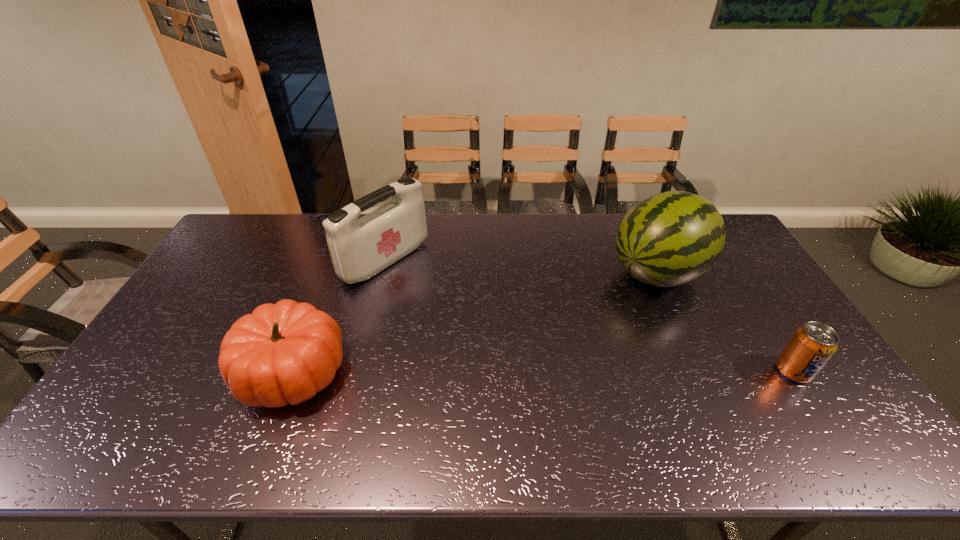
Find the location of a particular element. This screenshot has height=540, width=960. free point between the third object from left to right and the pumpkin is located at coordinates (475, 322).

Image resolution: width=960 pixels, height=540 pixels. I want to click on free space between the shortest object and the first-aid kit, so click(x=589, y=315).

This screenshot has width=960, height=540. What are the coordinates of `the second closest object to the rightmost object` in the screenshot? It's located at (360, 248).

Locate an element on the screen. The width and height of the screenshot is (960, 540). the second closest object relative to the third tallest object is located at coordinates (671, 238).

Locate an element on the screen. Image resolution: width=960 pixels, height=540 pixels. free point that satisfies the following two spatial constraints: 1. on the front side of the first-aid kit; 2. on the right side of the third object from left to right is located at coordinates (382, 273).

The width and height of the screenshot is (960, 540). I want to click on free spot that satisfies the following two spatial constraints: 1. on the back side of the second shortest object; 2. on the right side of the first-aid kit, so click(335, 260).

Find the location of `vacant point that satisfies the following two spatial constraints: 1. on the front side of the watermelon; 2. on the right side of the soda can`. vacant point that satisfies the following two spatial constraints: 1. on the front side of the watermelon; 2. on the right side of the soda can is located at coordinates (702, 370).